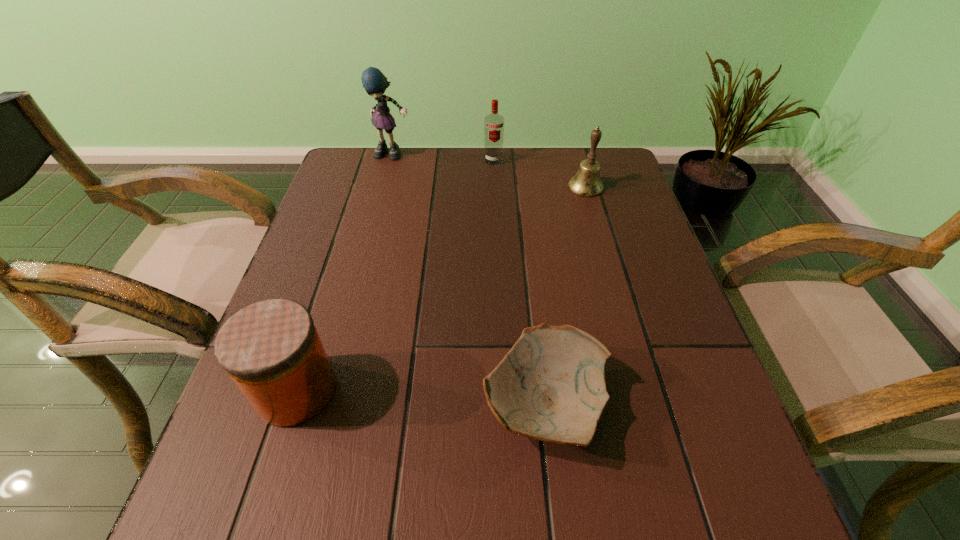
At what (x,y) coordinates should I click in order to perform the action: click on free space located on the back of the pottery. Please return your answer as a coordinate pair (x, y). Image resolution: width=960 pixels, height=540 pixels. Looking at the image, I should click on (535, 317).

This screenshot has height=540, width=960. What are the coordinates of `rag doll located in the far edge section of the desktop` in the screenshot? It's located at (374, 82).

In order to click on vodka present at the far edge in this screenshot , I will do `click(493, 123)`.

At what (x,y) coordinates should I click in order to perform the action: click on bell located at the far edge. Please return your answer as a coordinate pair (x, y). Looking at the image, I should click on (586, 183).

The width and height of the screenshot is (960, 540). I want to click on rag doll positioned at the left edge, so click(374, 82).

You are a GUI agent. You are given a task and a screenshot of the screen. Output one action in this format:
    pyautogui.click(x=<x>, y=<y>)
    Task: Click on the jar present at the left edge
    
    Given the screenshot: What is the action you would take?
    pyautogui.click(x=271, y=350)

At what (x,y) coordinates should I click in order to perform the action: click on object located at the right edge. Please return your answer as a coordinate pair (x, y). Image resolution: width=960 pixels, height=540 pixels. Looking at the image, I should click on pyautogui.click(x=586, y=183).

I want to click on object positioned at the far left corner, so click(374, 82).

At what (x,y) coordinates should I click in order to perform the action: click on object present at the far right corner. Please return your answer as a coordinate pair (x, y). Looking at the image, I should click on (586, 183).

What are the coordinates of `free space at the far edge of the desktop` in the screenshot? It's located at (471, 163).